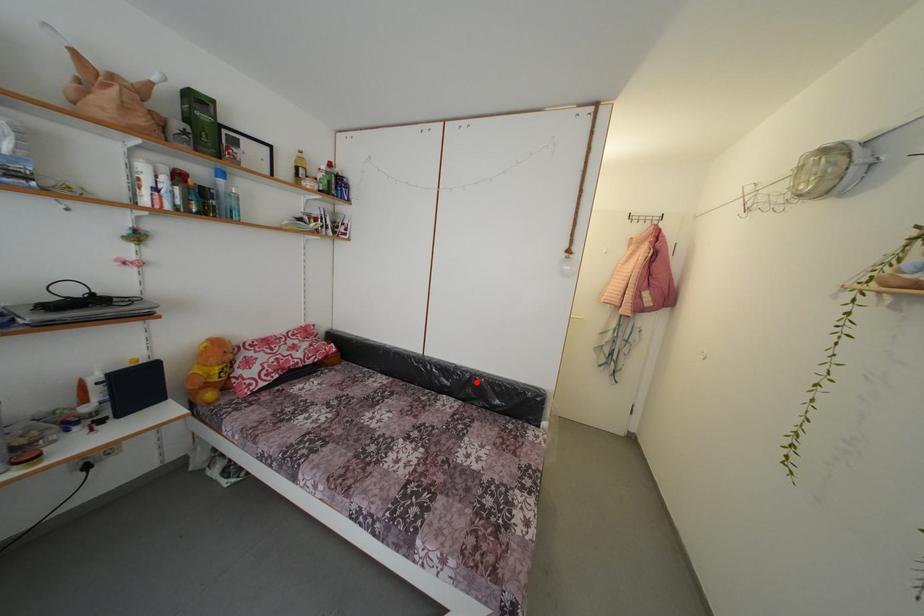
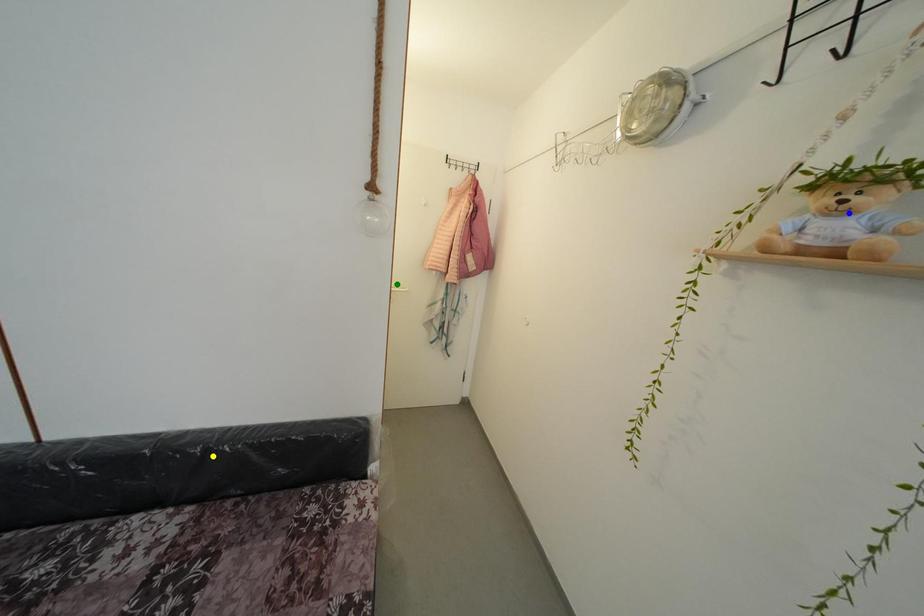
Question: I am providing you with two images of the same scene from different viewpoints. A red point is marked on the first image. You are given multiple points on the second image. Which point in image 2 represents the same 3d spot as the red point in image 1?

Choices:
 (A) green point
 (B) blue point
 (C) yellow point

Answer: (C)